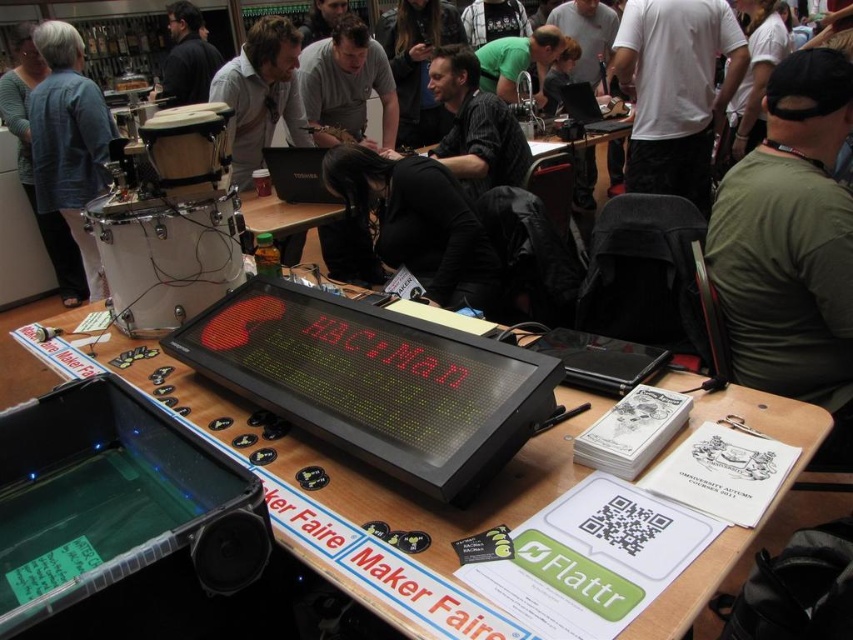
You are at the Maker Faire and need to locate the wooden table at center. According to the coordinates provided, where exactly is it positioned?

The wooden table at center is positioned at coordinates point (345,468).